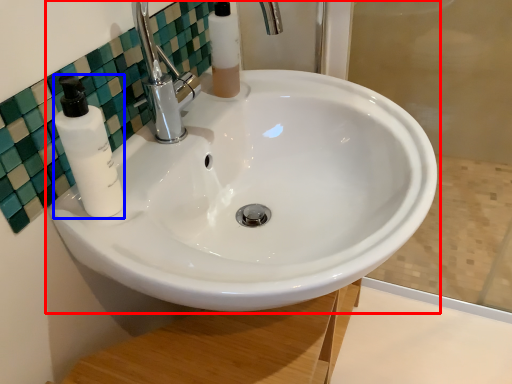
Question: Which point is further to the camera, sink (highlighted by a red box) or soap dispenser (highlighted by a blue box)?

Choices:
 (A) sink
 (B) soap dispenser

Answer: (B)